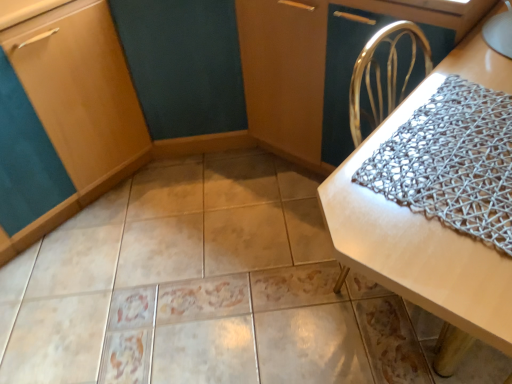
Question: Considering the relative sizes of matte wood cabinet at lower left and silver mesh blanket at right in the image provided, is matte wood cabinet at lower left wider than silver mesh blanket at right?

Choices:
 (A) yes
 (B) no

Answer: (A)

Question: Considering the relative sizes of matte wood cabinet at lower left and silver mesh blanket at right in the image provided, is matte wood cabinet at lower left shorter than silver mesh blanket at right?

Choices:
 (A) no
 (B) yes

Answer: (A)

Question: Can we say matte wood cabinet at lower left lies outside silver mesh blanket at right?

Choices:
 (A) no
 (B) yes

Answer: (B)

Question: Is there a large distance between matte wood cabinet at lower left and silver mesh blanket at right?

Choices:
 (A) no
 (B) yes

Answer: (B)

Question: From the image's perspective, is matte wood cabinet at lower left below silver mesh blanket at right?

Choices:
 (A) no
 (B) yes

Answer: (A)

Question: Does matte wood cabinet at lower left have a smaller size compared to silver mesh blanket at right?

Choices:
 (A) yes
 (B) no

Answer: (B)

Question: Is matte wood cabinet at lower left taller than white woven placemat at center?

Choices:
 (A) yes
 (B) no

Answer: (A)

Question: Does matte wood cabinet at lower left appear on the right side of white woven placemat at center?

Choices:
 (A) yes
 (B) no

Answer: (B)

Question: Can you confirm if matte wood cabinet at lower left is positioned to the left of white woven placemat at center?

Choices:
 (A) yes
 (B) no

Answer: (A)

Question: Is matte wood cabinet at lower left positioned in front of white woven placemat at center?

Choices:
 (A) yes
 (B) no

Answer: (B)

Question: From the image's perspective, is matte wood cabinet at lower left under white woven placemat at center?

Choices:
 (A) yes
 (B) no

Answer: (B)

Question: Is matte wood cabinet at lower left smaller than white woven placemat at center?

Choices:
 (A) yes
 (B) no

Answer: (A)

Question: Can you confirm if beige glossy tile at center is shorter than white woven placemat at center?

Choices:
 (A) yes
 (B) no

Answer: (A)